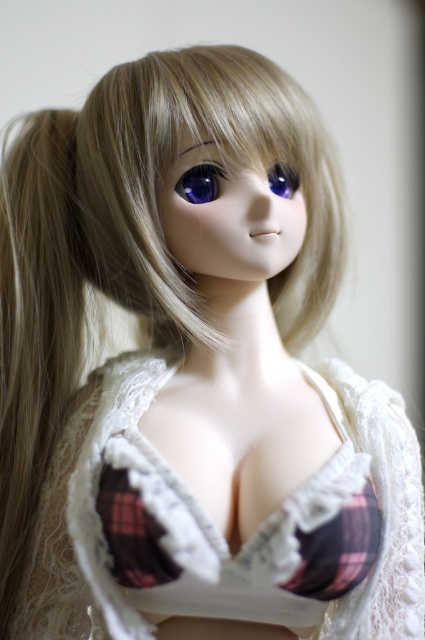
Question: Can you confirm if glossy plastic eye at center is positioned above purple glossy eye at center?

Choices:
 (A) yes
 (B) no

Answer: (B)

Question: Which is nearer to the matte brown eyebrow at upper center?

Choices:
 (A) glossy plastic eye at center
 (B) purple glossy eye at center

Answer: (A)

Question: Can you confirm if plaid fabric bra at center is positioned above glossy plastic eye at center?

Choices:
 (A) no
 (B) yes

Answer: (A)

Question: Can you confirm if plaid fabric bra at center is positioned above purple glossy eye at center?

Choices:
 (A) yes
 (B) no

Answer: (B)

Question: Which point is closer to the camera taking this photo?

Choices:
 (A) (201, 173)
 (B) (209, 141)
 (C) (271, 179)
 (D) (61, 608)

Answer: (B)

Question: Which of the following is the farthest from the observer?

Choices:
 (A) (206, 202)
 (B) (277, 170)

Answer: (B)